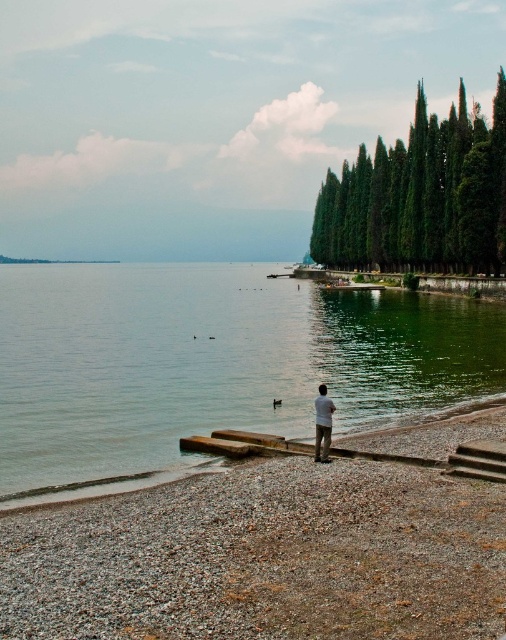
Question: Which point appears closest to the camera in this image?

Choices:
 (A) (475, 444)
 (B) (325, 400)

Answer: (A)

Question: In this image, where is green textured cypress trees at upper right located relative to brown wooden dock at lower center?

Choices:
 (A) above
 (B) below

Answer: (A)

Question: Among these points, which one is nearest to the camera?

Choices:
 (A) click(x=489, y=470)
 (B) click(x=504, y=232)
 (C) click(x=189, y=396)

Answer: (A)

Question: Is green smooth water at center thinner than light brown fabric pants at center?

Choices:
 (A) no
 (B) yes

Answer: (A)

Question: Which object is the closest to the light brown fabric pants at center?

Choices:
 (A) gravelly sand beach at lower center
 (B) brown wooden dock at lower center
 (C) green textured cypress trees at upper right
 (D) green smooth water at center

Answer: (B)

Question: Is green textured cypress trees at upper right positioned in front of light brown fabric pants at center?

Choices:
 (A) no
 (B) yes

Answer: (A)